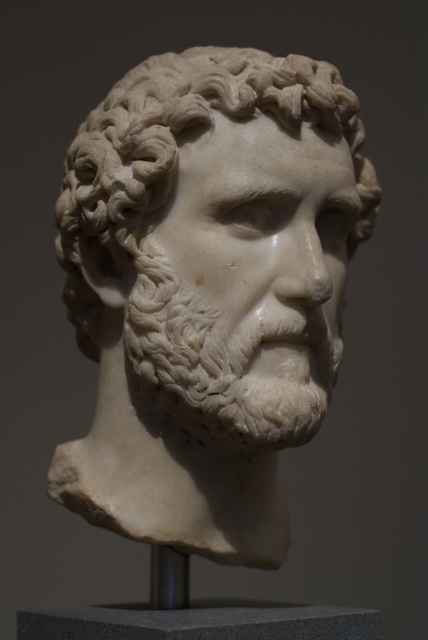
Can you confirm if white marble bust at center is bigger than gray granite pedestal at center?

Yes.

Between white marble bust at center and gray granite pedestal at center, which one is positioned lower?

Positioned lower is gray granite pedestal at center.

At what (x,y) coordinates should I click in order to perform the action: click on white marble bust at center. Please return your answer as a coordinate pair (x, y). This screenshot has height=640, width=428. Looking at the image, I should click on (166, 256).

The image size is (428, 640). In order to click on white marble bust at center in this screenshot , I will do `click(166, 256)`.